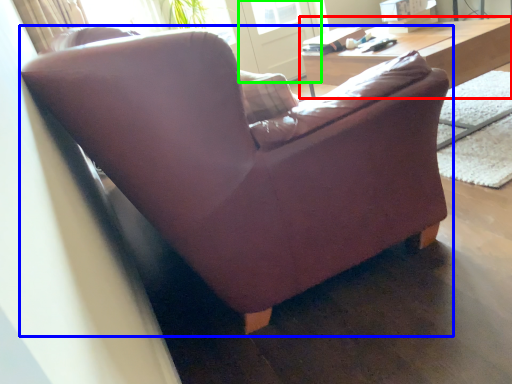
Question: Estimate the real-world distances between objects in this image. Which object is farther from table (highlighted by a red box), studio couch (highlighted by a blue box) or screen door (highlighted by a green box)?

Choices:
 (A) studio couch
 (B) screen door

Answer: (B)